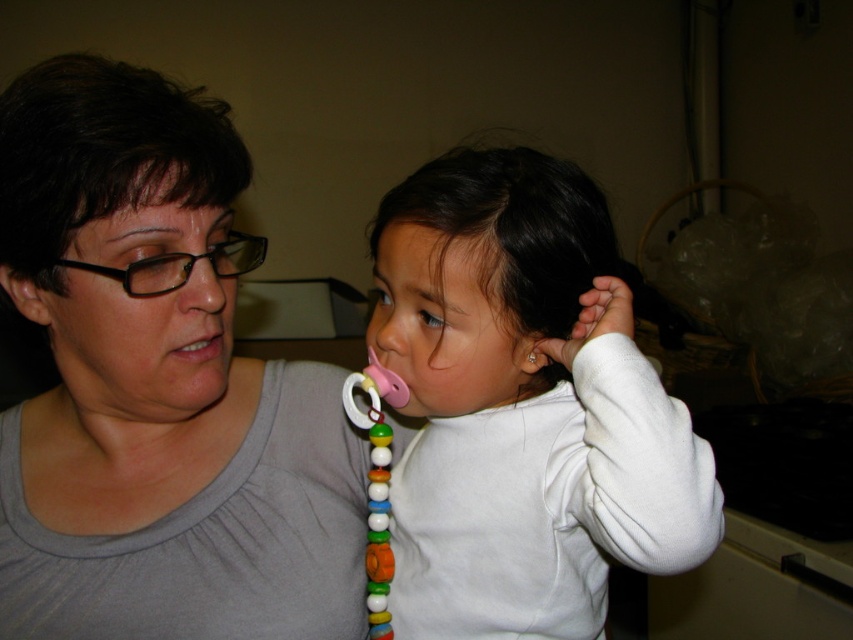
Question: Is matte gray shirt at center closer to the viewer compared to smooth skin at center?

Choices:
 (A) yes
 (B) no

Answer: (A)

Question: Which of these objects is positioned closest to the matte gray shirt at center?

Choices:
 (A) multicolored plastic pacifier at center
 (B) pink rubber pacifier at center
 (C) matte black ear at left
 (D) smooth skin at center

Answer: (A)

Question: Considering the real-world distances, which object is farthest from the matte black ear at left?

Choices:
 (A) pink rubber nose at center
 (B) multicolored plastic pacifier at center
 (C) pink rubber pacifier at center
 (D) matte black forehead at upper left

Answer: (C)

Question: Is pink rubber nose at center to the left of matte skin mouth at center from the viewer's perspective?

Choices:
 (A) yes
 (B) no

Answer: (B)

Question: Which point is farther to the camera?

Choices:
 (A) pink rubber pacifier at center
 (B) matte skin mouth at center
 (C) matte black ear at left
 (D) pink plastic teething ring at center

Answer: (D)

Question: Can you confirm if matte gray shirt at center is positioned below matte black ear at left?

Choices:
 (A) no
 (B) yes

Answer: (B)